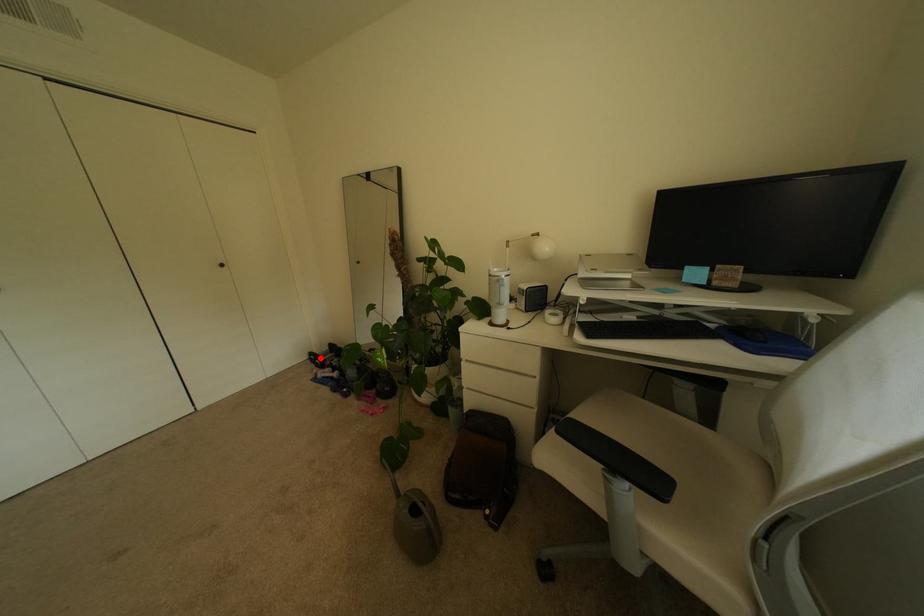
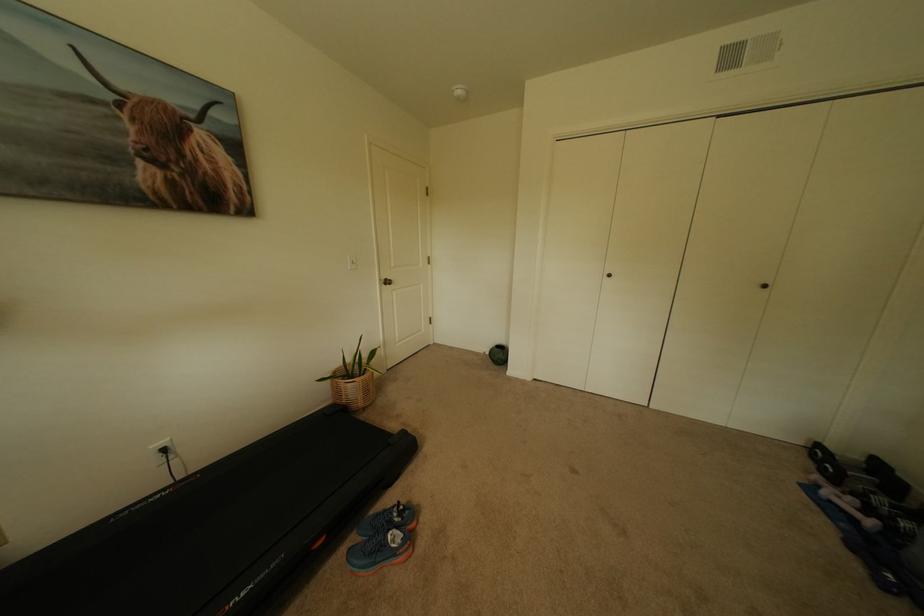
Question: I am providing you with two images of the same scene from different viewpoints. A red point is marked on the first image. Can you still see the location of the red point in image 2?

Choices:
 (A) Yes
 (B) No

Answer: (A)